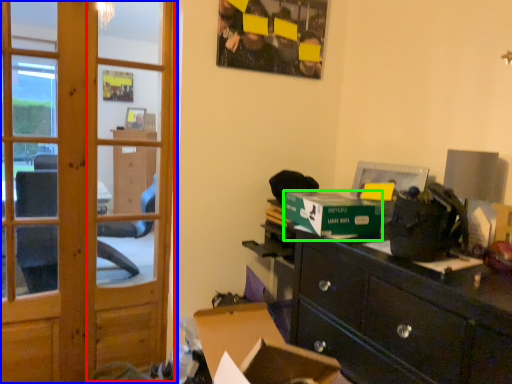
Question: Which object is positioned farthest from screen door (highlighted by a red box)? Select from door (highlighted by a blue box) and cardboard box (highlighted by a green box).

Choices:
 (A) door
 (B) cardboard box

Answer: (B)